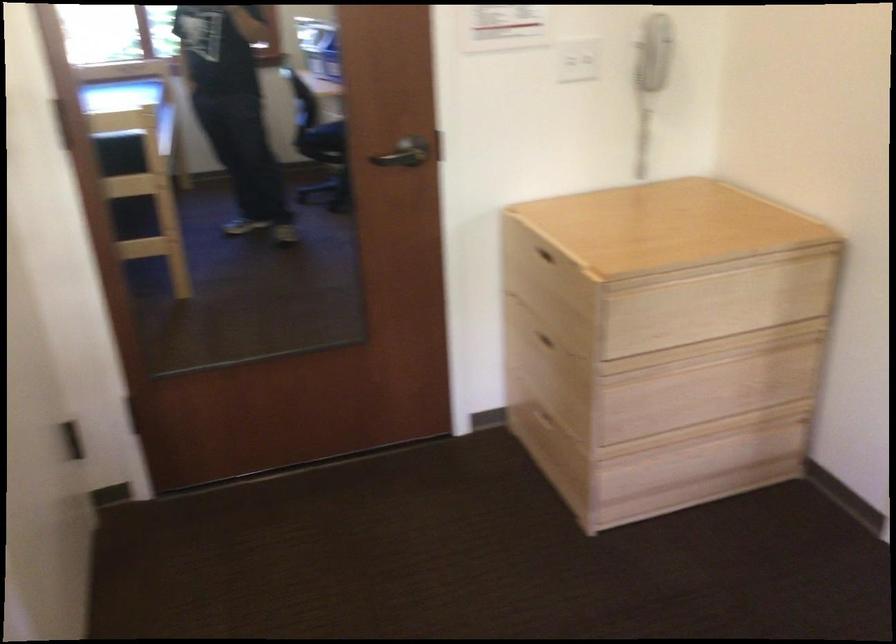
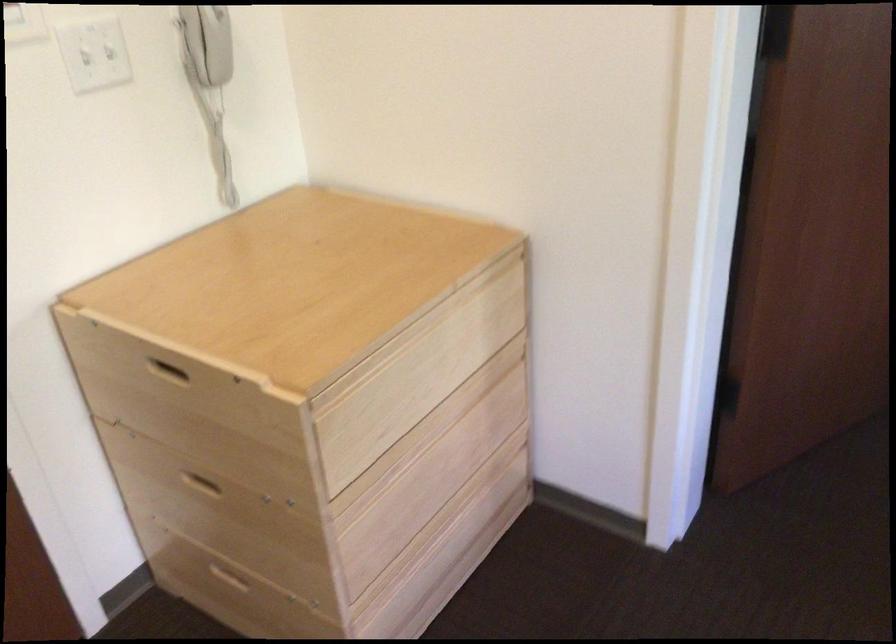
Where in the second image is the point corresponding to pixel 541 339 from the first image?

(201, 483)